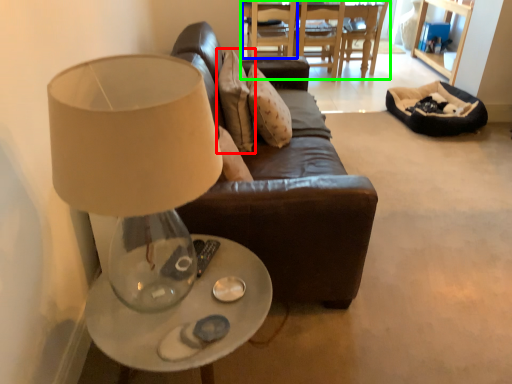
Question: Which object is the farthest from pillow (highlighted by a red box)? Choose among these: chair (highlighted by a blue box) or table (highlighted by a green box).

Choices:
 (A) chair
 (B) table

Answer: (B)